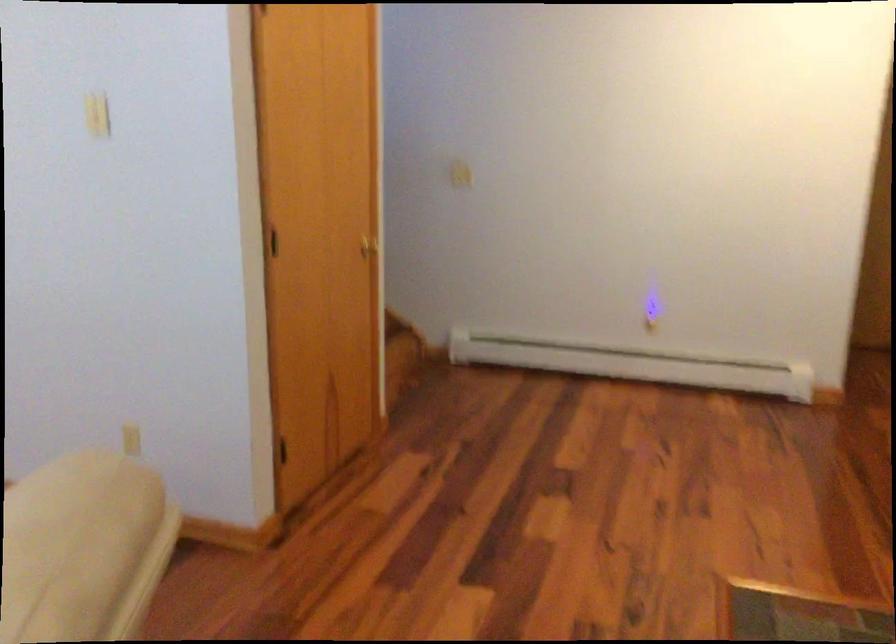
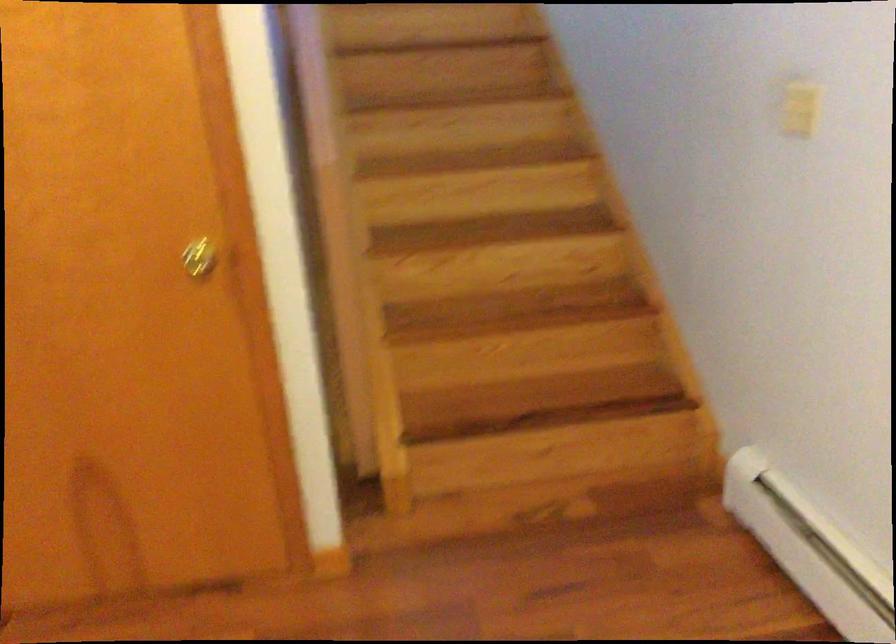
The first image is from the beginning of the video and the second image is from the end. How did the camera likely rotate when shooting the video?

The camera's rotation is toward right-down.